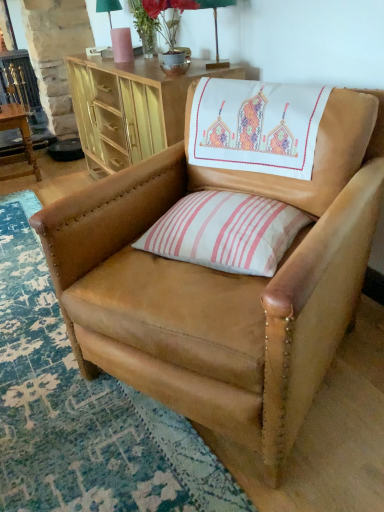
Question: Does tan leather chair at center have a larger size compared to green fabric table lamp at upper center, placed as the first table lamp when sorted from front to back?

Choices:
 (A) no
 (B) yes

Answer: (B)

Question: Is tan leather chair at center located outside green fabric table lamp at upper center, the second table lamp in the back-to-front sequence?

Choices:
 (A) yes
 (B) no

Answer: (A)

Question: Can you confirm if tan leather chair at center is thinner than green fabric table lamp at upper center, placed as the first table lamp when sorted from front to back?

Choices:
 (A) no
 (B) yes

Answer: (A)

Question: Is tan leather chair at center closer to the viewer compared to green fabric table lamp at upper center, the 2th table lamp viewed from the top?

Choices:
 (A) yes
 (B) no

Answer: (A)

Question: From the image's perspective, would you say tan leather chair at center is shown under green fabric table lamp at upper center, placed as the 2th table lamp when sorted from left to right?

Choices:
 (A) no
 (B) yes

Answer: (B)

Question: Is pink striped fabric pillow at center bigger or smaller than tan leather chair at center?

Choices:
 (A) big
 (B) small

Answer: (B)

Question: Considering the positions of pink striped fabric pillow at center and tan leather chair at center in the image, is pink striped fabric pillow at center taller or shorter than tan leather chair at center?

Choices:
 (A) tall
 (B) short

Answer: (B)

Question: Is pink striped fabric pillow at center wider or thinner than tan leather chair at center?

Choices:
 (A) wide
 (B) thin

Answer: (B)

Question: Does point (215, 266) appear closer or farther from the camera than point (369, 232)?

Choices:
 (A) closer
 (B) farther

Answer: (A)

Question: From a real-world perspective, relative to green fabric lampshade at upper center, which is the 2th table lamp in front-to-back order, is pink striped fabric pillow at center vertically above or below?

Choices:
 (A) above
 (B) below

Answer: (B)

Question: Is pink striped fabric pillow at center inside the boundaries of green fabric lampshade at upper center, which is the 2th table lamp in front-to-back order, or outside?

Choices:
 (A) inside
 (B) outside

Answer: (B)

Question: From their relative heights in the image, would you say pink striped fabric pillow at center is taller or shorter than green fabric lampshade at upper center, which is the 2th table lamp in front-to-back order?

Choices:
 (A) short
 (B) tall

Answer: (A)

Question: Considering the positions of point (274, 206) and point (96, 11), is point (274, 206) closer or farther from the camera than point (96, 11)?

Choices:
 (A) closer
 (B) farther

Answer: (A)

Question: From the image's perspective, relative to matte gold desk at upper center, is green fabric table lamp at upper center, the 1th table lamp ordered from the bottom, above or below?

Choices:
 (A) below
 (B) above

Answer: (B)

Question: In terms of width, does green fabric table lamp at upper center, placed as the first table lamp when sorted from front to back, look wider or thinner when compared to matte gold desk at upper center?

Choices:
 (A) wide
 (B) thin

Answer: (B)